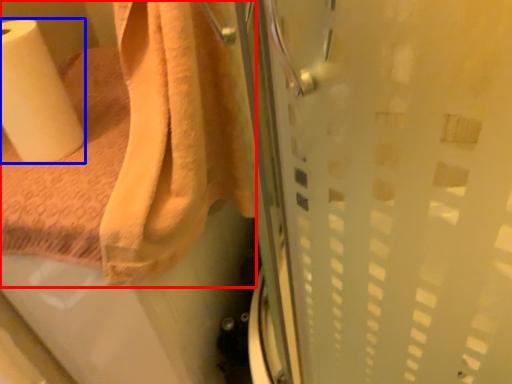
Question: Which object is closer to the camera taking this photo, towel (highlighted by a red box) or paper towel (highlighted by a blue box)?

Choices:
 (A) towel
 (B) paper towel

Answer: (A)